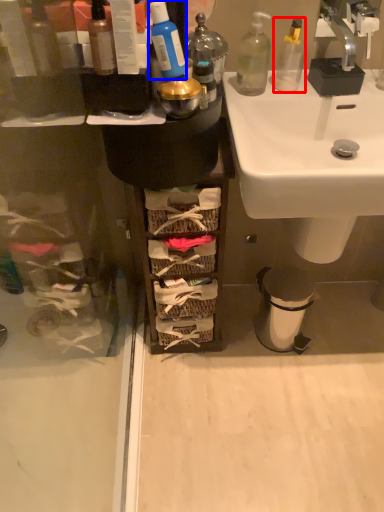
Question: Which point is further to the camera, bottle (highlighted by a red box) or toiletry (highlighted by a blue box)?

Choices:
 (A) bottle
 (B) toiletry

Answer: (A)